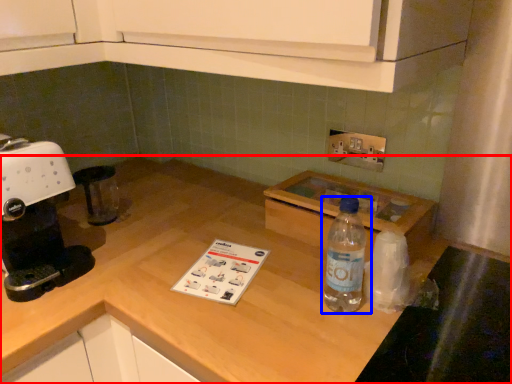
Question: Which object appears closest to the camera in this image, countertop (highlighted by a red box) or bottle (highlighted by a blue box)?

Choices:
 (A) countertop
 (B) bottle

Answer: (A)